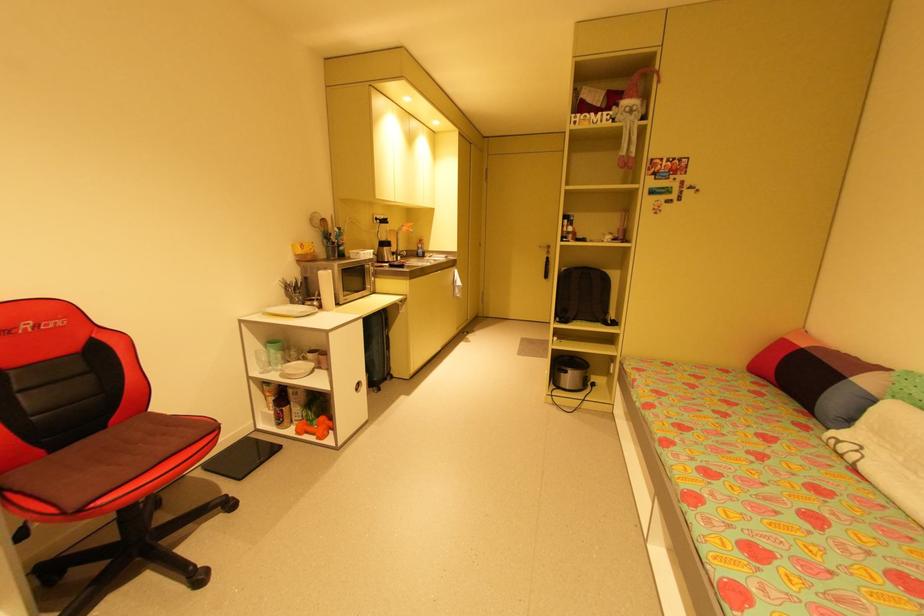
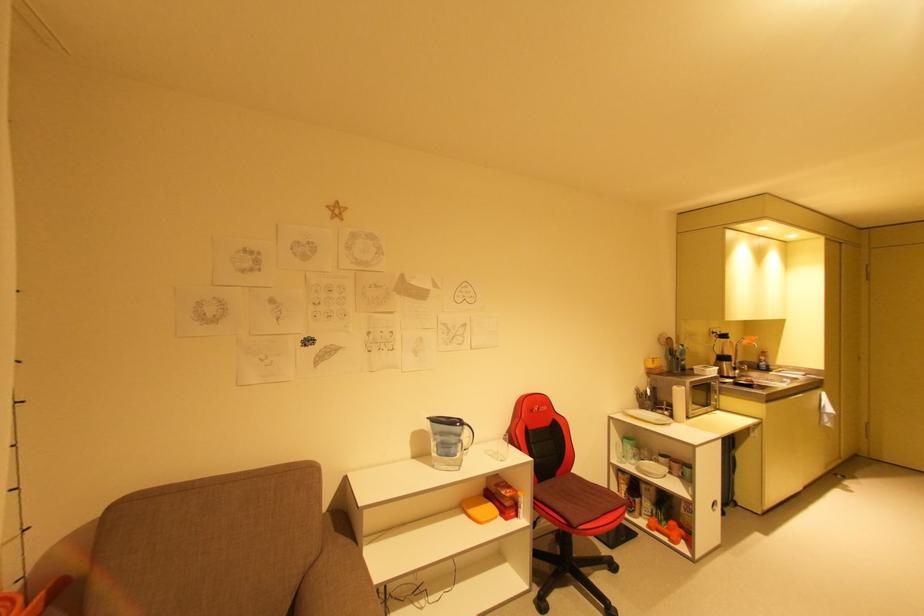
The point at (412, 227) is marked in the first image. Where is the corresponding point in the second image?

(756, 341)